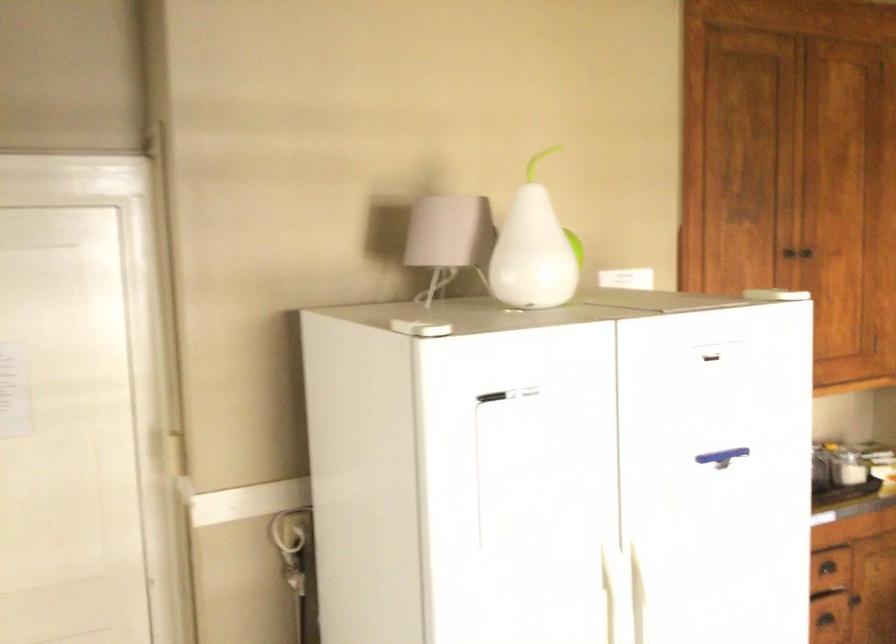
What do you see at coordinates (786, 257) in the screenshot? Image resolution: width=896 pixels, height=644 pixels. I see `the black drawer handle` at bounding box center [786, 257].